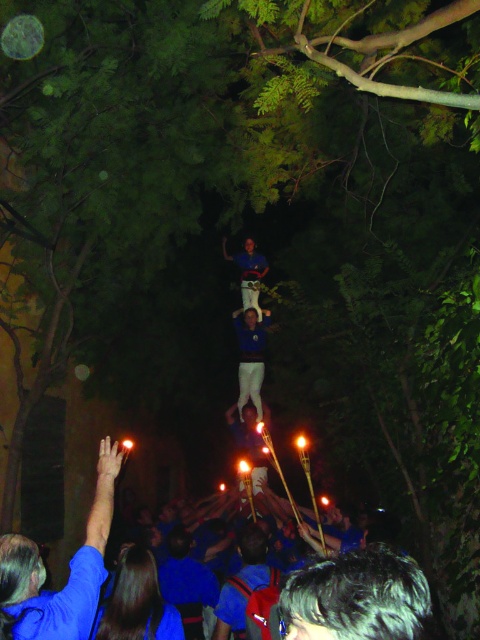
You are standing at the center of the scene and want to reach the blue fabric hand at lower left. Which direction should you move to get there?

The blue fabric hand at lower left is located at coordinates point (69, 573), so you should move towards the lower left direction to reach it.

You are a photographer trying to capture the human tower in the nighttime scene. You notice a blue fabric hand at lower left located at point (69, 573). To ensure the hand is in focus, where should you adjust your camera focus to?

You should adjust your camera focus to point (69, 573) where the blue fabric hand at lower left is located.